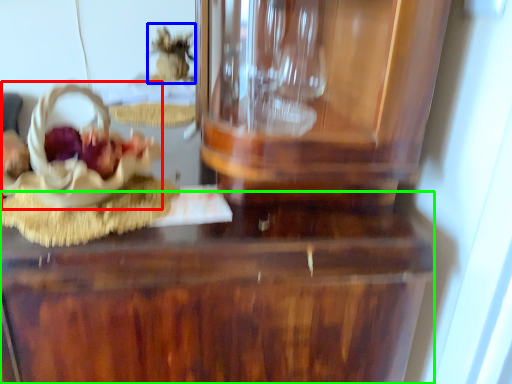
Question: Which is farther away from stuff (highlighted by a red box)? stuff (highlighted by a blue box) or table (highlighted by a green box)?

Choices:
 (A) stuff
 (B) table

Answer: (A)